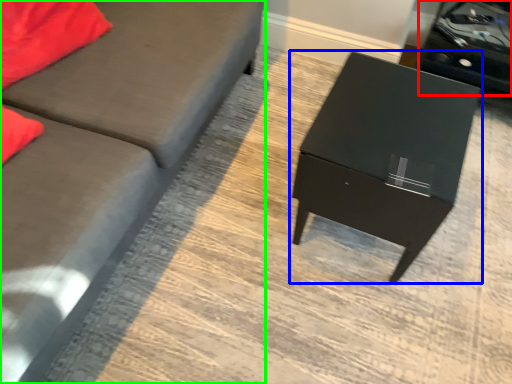
Question: Which object is positioned farthest from side table (highlighted by a red box)? Select from table (highlighted by a blue box) and studio couch (highlighted by a green box).

Choices:
 (A) table
 (B) studio couch

Answer: (B)